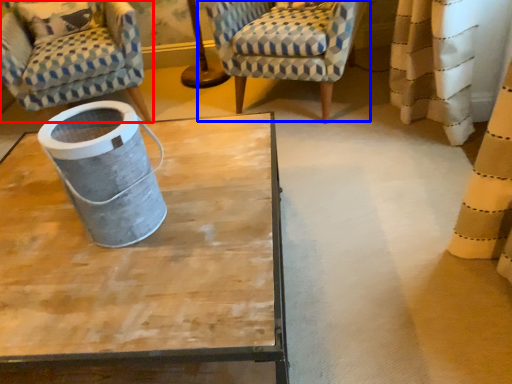
Question: Which of the following is the farthest to the observer, chair (highlighted by a red box) or chair (highlighted by a blue box)?

Choices:
 (A) chair
 (B) chair

Answer: (A)